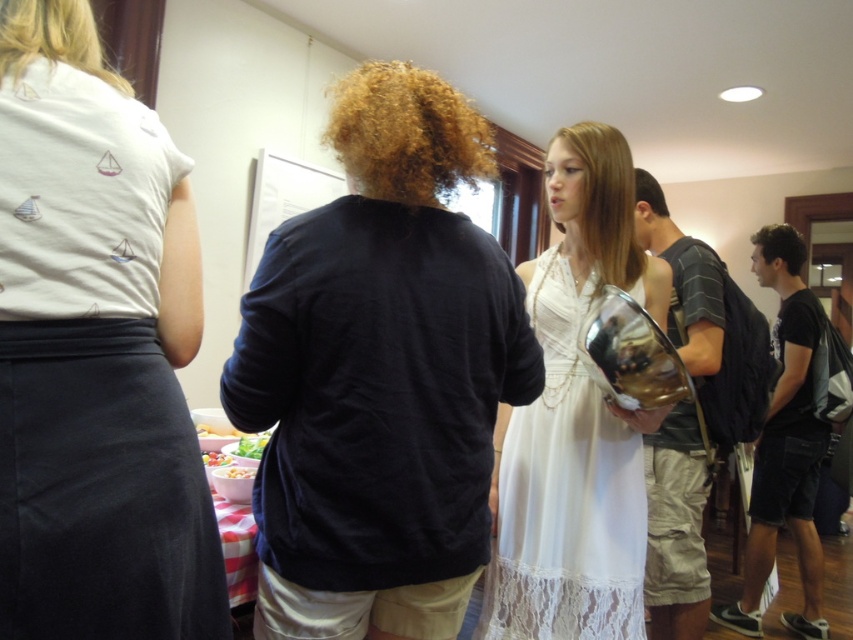
Does smooth brown hair at center come behind dark brown curly hair at right?

No, smooth brown hair at center is closer to the viewer.

Does smooth brown hair at center have a greater height compared to dark brown curly hair at right?

Yes.

Find the location of `smooth brown hair at center`. smooth brown hair at center is located at coordinates [x=605, y=202].

Based on the photo, can you confirm if curly blonde hair at center is bigger than blonde hair at upper left?

Yes.

Is point (343, 141) more distant than point (49, 49)?

Yes, point (343, 141) is behind point (49, 49).

You are a GUI agent. You are given a task and a screenshot of the screen. Output one action in this format:
    pyautogui.click(x=<x>, y=<y>)
    Task: Click on the curly blonde hair at center
    The height and width of the screenshot is (640, 853).
    Given the screenshot: What is the action you would take?
    pyautogui.click(x=405, y=132)

Is smooth brown hair at center wider than blonde hair at upper left?

Yes.

I want to click on smooth brown hair at center, so click(x=605, y=202).

At what (x,y) coordinates should I click in order to perform the action: click on smooth brown hair at center. Please return your answer as a coordinate pair (x, y). Looking at the image, I should click on (605, 202).